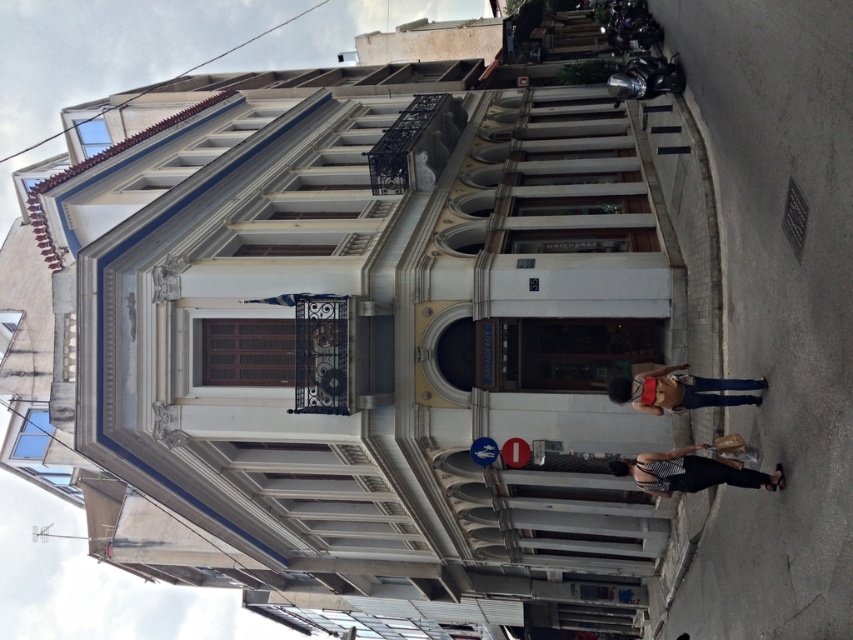
Question: Which point is farther to the camera?

Choices:
 (A) (769, 483)
 (B) (709, 388)

Answer: (B)

Question: Where is striped fabric dress at lower center located in relation to denim jeans at lower right in the image?

Choices:
 (A) below
 (B) above

Answer: (A)

Question: Which point is closer to the camera?

Choices:
 (A) (686, 484)
 (B) (680, 406)

Answer: (A)

Question: Which object appears closest to the camera in this image?

Choices:
 (A) denim jeans at lower right
 (B) striped fabric dress at lower center

Answer: (B)

Question: Can you confirm if striped fabric dress at lower center is smaller than denim jeans at lower right?

Choices:
 (A) no
 (B) yes

Answer: (B)

Question: Does striped fabric dress at lower center have a smaller size compared to denim jeans at lower right?

Choices:
 (A) no
 (B) yes

Answer: (B)